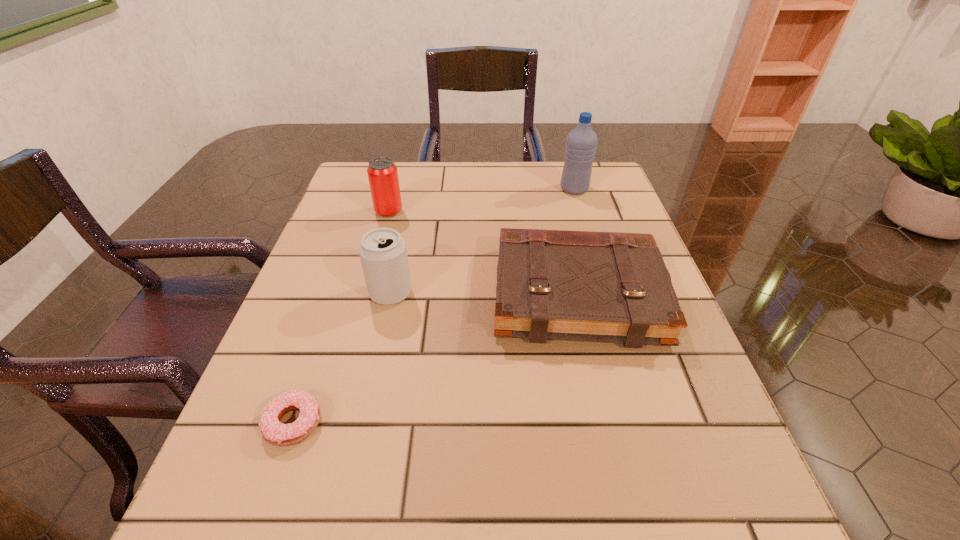
Locate an element on the screen. The image size is (960, 540). free spot between the water bottle and the doughnut is located at coordinates (434, 306).

The width and height of the screenshot is (960, 540). Find the location of `vacant space in between the hardback book and the nearer can`. vacant space in between the hardback book and the nearer can is located at coordinates (484, 293).

The width and height of the screenshot is (960, 540). What are the coordinates of `object that is the closest one to the nearest object` in the screenshot? It's located at (383, 254).

Point out which object is positioned as the fourth nearest to the farther can. Please provide its 2D coordinates. Your answer should be formatted as a tuple, i.e. [(x, y)], where the tuple contains the x and y coordinates of a point satisfying the conditions above.

[(279, 434)]

Find the location of `free spot that satisfies the following two spatial constraints: 1. on the back side of the farthest object; 2. on the left side of the nearer can`. free spot that satisfies the following two spatial constraints: 1. on the back side of the farthest object; 2. on the left side of the nearer can is located at coordinates (413, 189).